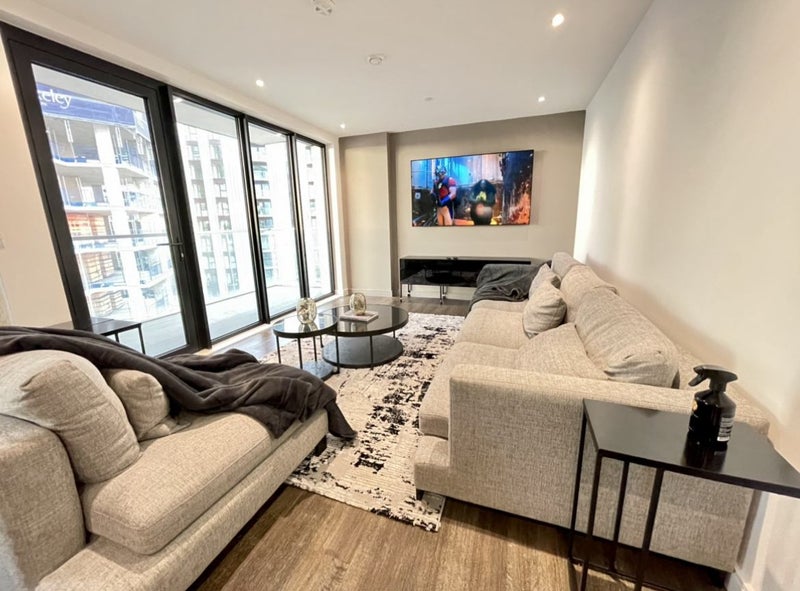
I want to click on lights, so click(x=560, y=21).